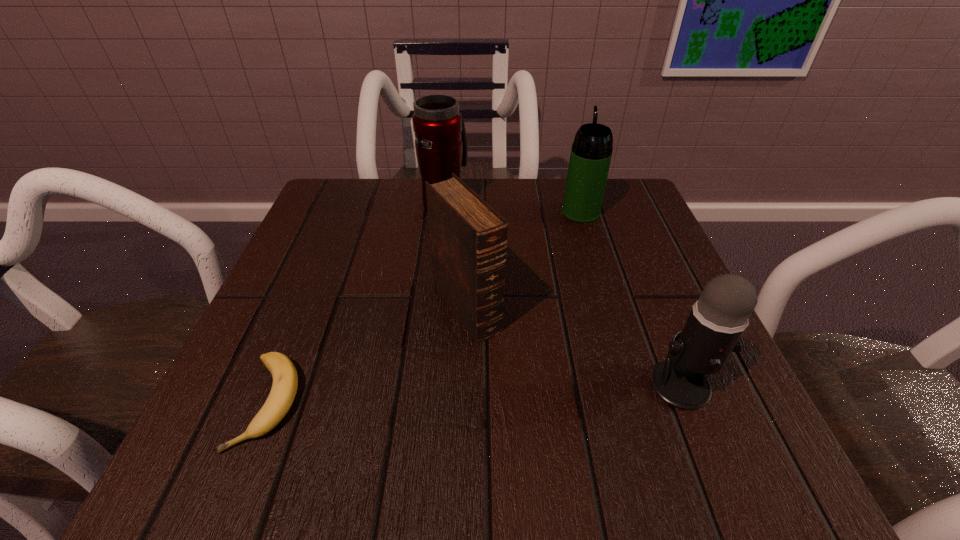
Find the location of a particular element. object located in the left edge section of the desktop is located at coordinates (285, 379).

At what (x,y) coordinates should I click in order to perform the action: click on thermos bottle present at the right edge. Please return your answer as a coordinate pair (x, y). The image size is (960, 540). Looking at the image, I should click on (591, 152).

This screenshot has height=540, width=960. I want to click on microphone situated at the right edge, so click(x=717, y=320).

In order to click on object that is at the near left corner in this screenshot , I will do `click(285, 379)`.

At what (x,y) coordinates should I click in order to perform the action: click on object situated at the far right corner. Please return your answer as a coordinate pair (x, y). The height and width of the screenshot is (540, 960). Looking at the image, I should click on (591, 152).

You are a GUI agent. You are given a task and a screenshot of the screen. Output one action in this format:
    pyautogui.click(x=<x>, y=<y>)
    Task: Click on the free region at the far edge
    The image size is (960, 540).
    Given the screenshot: What is the action you would take?
    pyautogui.click(x=544, y=215)

Identify the location of free region at the near edge of the desktop. The width and height of the screenshot is (960, 540). (589, 480).

You are a GUI agent. You are given a task and a screenshot of the screen. Output one action in this format:
    pyautogui.click(x=<x>, y=<y>)
    Task: Click on the vacant space at the left edge of the desktop
    The height and width of the screenshot is (540, 960).
    Given the screenshot: What is the action you would take?
    coord(342,251)

This screenshot has height=540, width=960. I want to click on vacant space at the right edge of the desktop, so click(658, 292).

In the image, there is a desktop. What are the coordinates of `vacant space at the far left corner` in the screenshot? It's located at (366, 208).